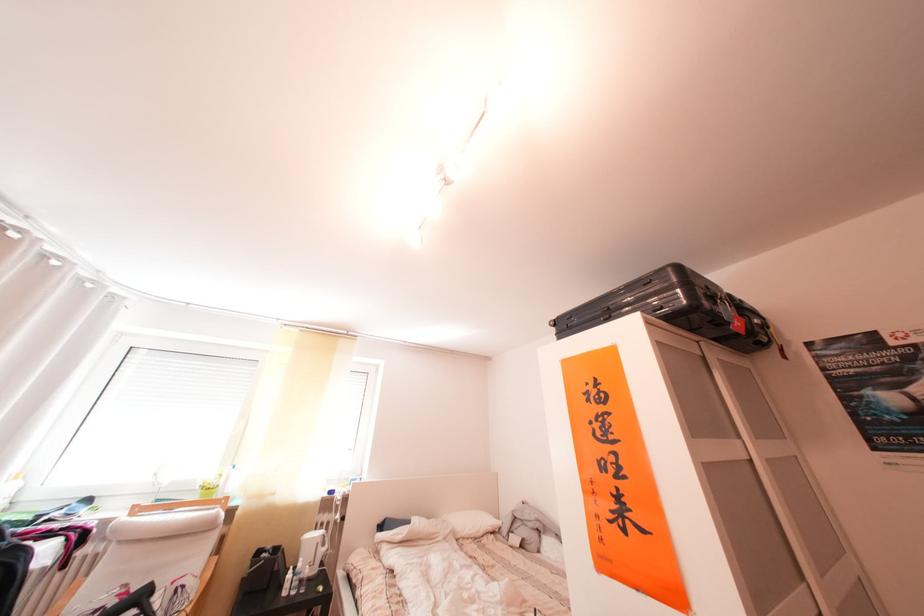
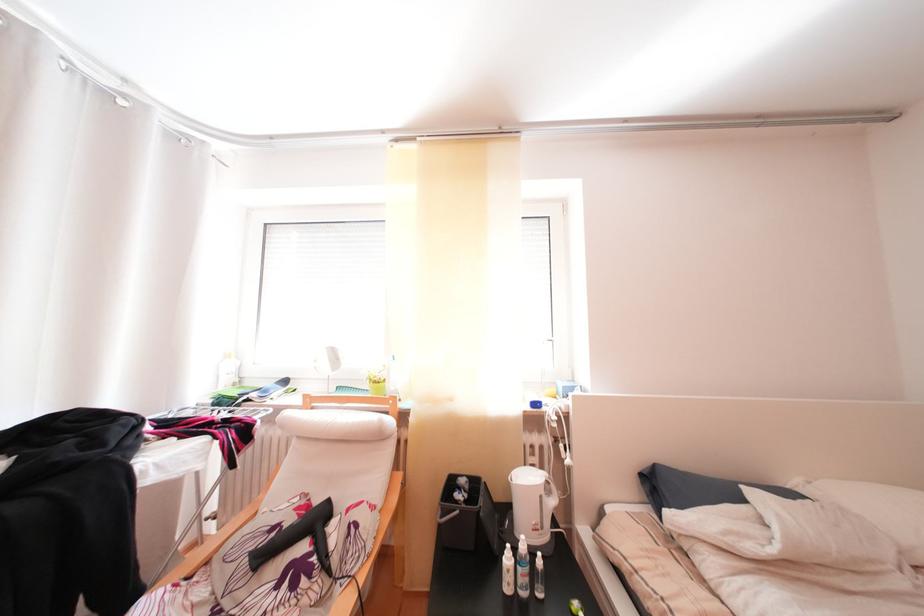
Locate, in the second image, the point that corresponds to pixel 332 546 in the first image.

(554, 498)